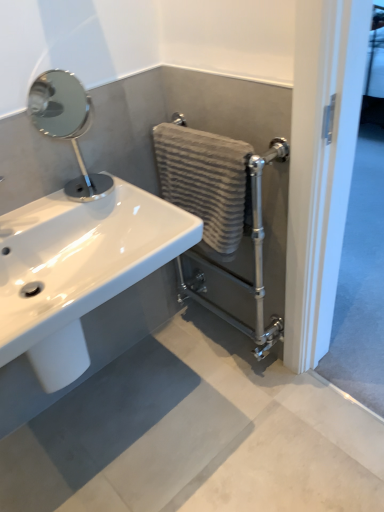
Find the location of a particular element. The width and height of the screenshot is (384, 512). vacant space underneath white glossy sink at lower left (from a real-world perspective) is located at coordinates (129, 410).